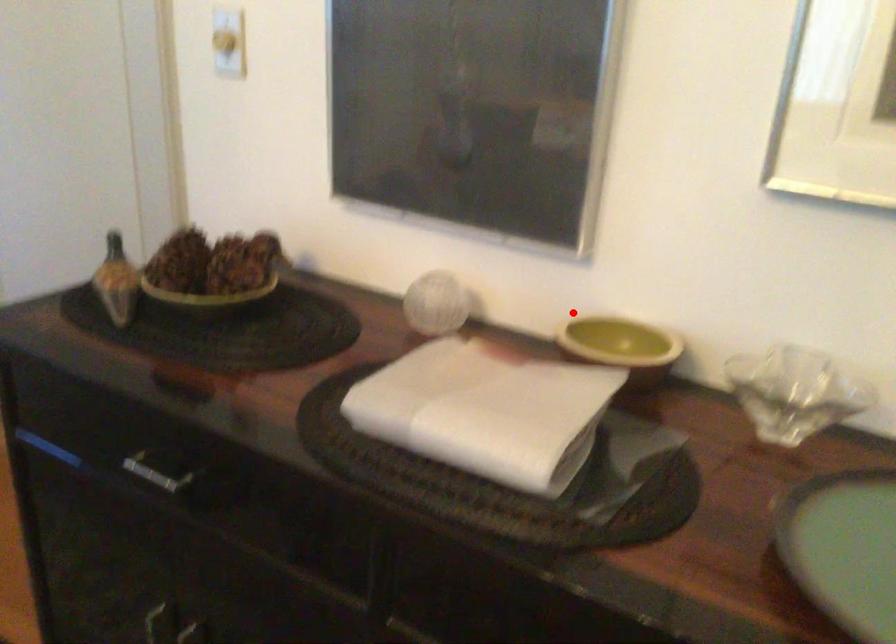
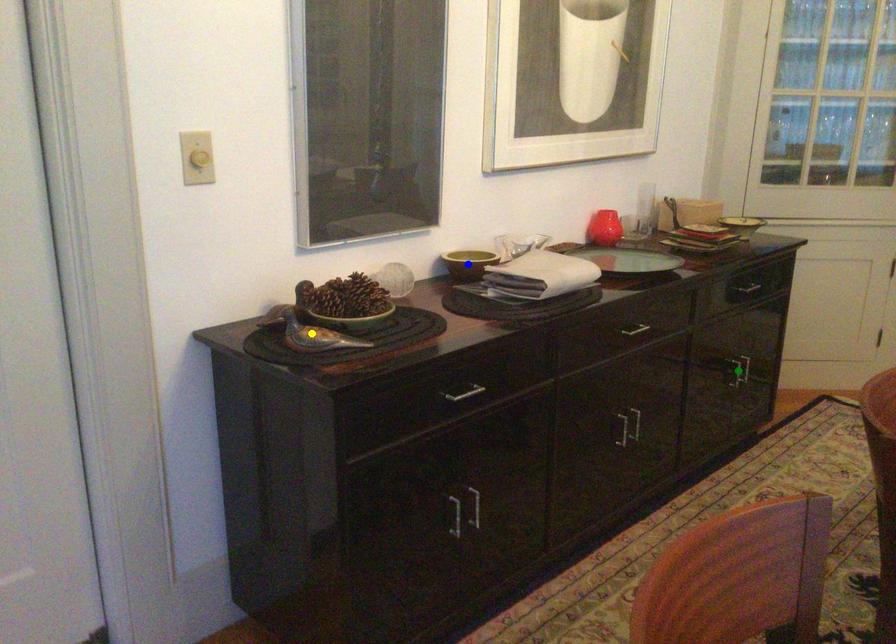
Question: I am providing you with two images of the same scene from different viewpoints. A red point is marked on the first image. You are given multiple points on the second image. Which spot in image 2 lines up with the point in image 1?

Choices:
 (A) green point
 (B) yellow point
 (C) blue point

Answer: (C)